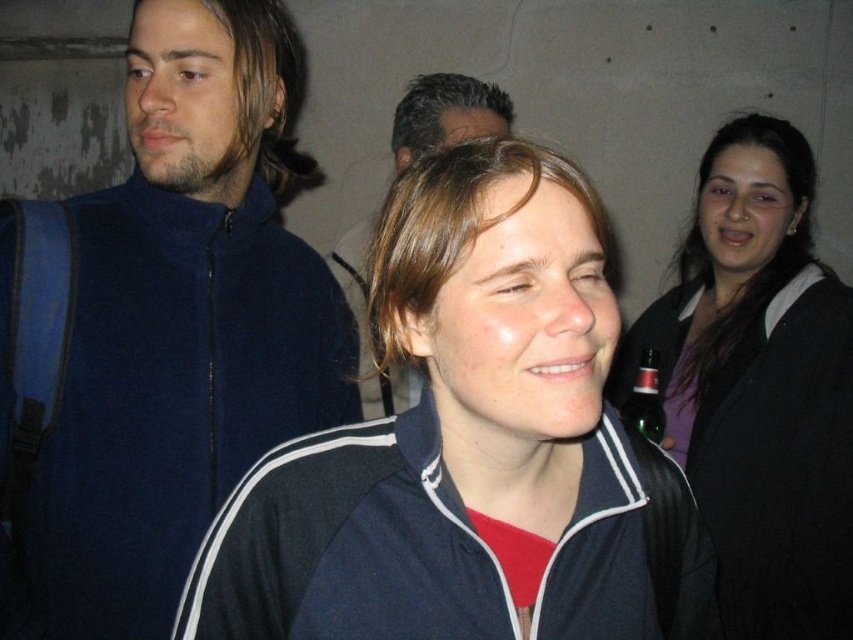
Can you confirm if matte black jacket at right is positioned to the left of green glass bottle at right?

In fact, matte black jacket at right is to the right of green glass bottle at right.

What do you see at coordinates (759, 385) in the screenshot? I see `matte black jacket at right` at bounding box center [759, 385].

Find the location of a particular element. matte black jacket at right is located at coordinates tap(759, 385).

Is dark blue track jacket at center wider than matte black jacket at right?

Correct, the width of dark blue track jacket at center exceeds that of matte black jacket at right.

Does dark blue track jacket at center come behind matte black jacket at right?

No, it is in front of matte black jacket at right.

Is point (401, 436) in front of point (843, 292)?

Yes.

Locate an element on the screen. This screenshot has width=853, height=640. dark blue track jacket at center is located at coordinates coord(468,444).

Which is in front, point (556, 536) or point (273, 49)?

Point (556, 536) is in front.

Is dark blue track jacket at center positioned at the back of blue fleece jacket at left?

No, dark blue track jacket at center is closer to the viewer.

Who is more forward, (505, 406) or (183, 428)?

Point (505, 406)

In order to click on dark blue track jacket at center in this screenshot , I will do `click(468, 444)`.